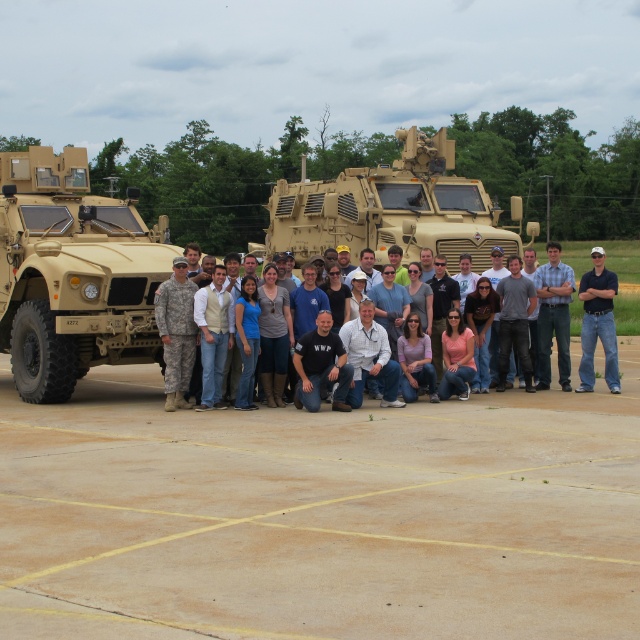
Question: Is black matte shirt at center above white matte baseball cap at center?

Choices:
 (A) no
 (B) yes

Answer: (A)

Question: Which object appears farthest from the camera in this image?

Choices:
 (A) white shirt at center
 (B) black matte shirt at center
 (C) dark blue shirt at center

Answer: (C)

Question: Observing the image, what is the correct spatial positioning of blue shirt at center in reference to dark blue shirt at center?

Choices:
 (A) below
 (B) above

Answer: (A)

Question: Considering the relative positions of white shirt at center and white matte baseball cap at center in the image provided, where is white shirt at center located with respect to white matte baseball cap at center?

Choices:
 (A) above
 (B) below

Answer: (B)

Question: Which object appears closest to the camera in this image?

Choices:
 (A) dark blue shirt at center
 (B) black matte shirt at center
 (C) white shirt at center
 (D) black cotton shirt at center

Answer: (C)

Question: Which object is the farthest from the blue shirt at center?

Choices:
 (A) camouflage fabric armored vehicle at left
 (B) dark blue shirt at center

Answer: (A)